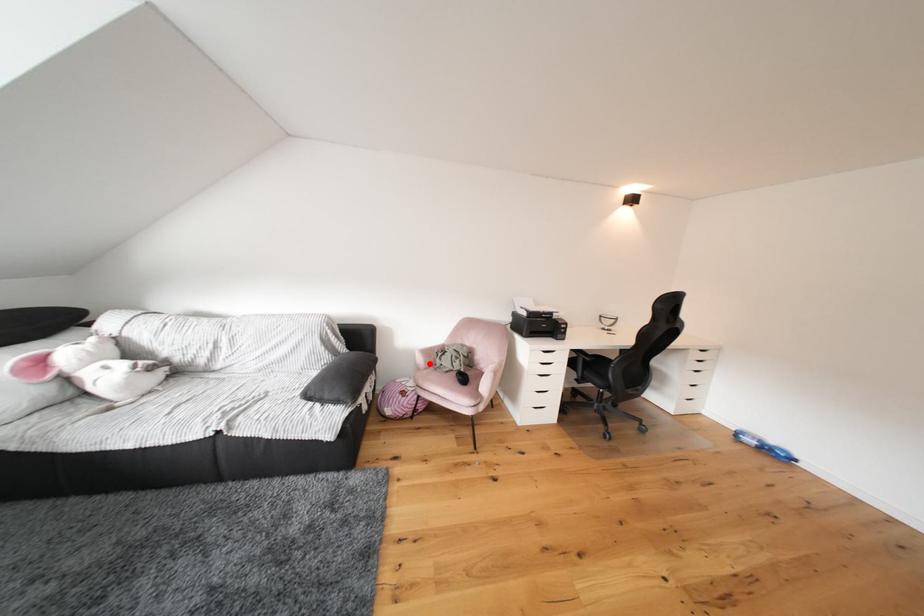
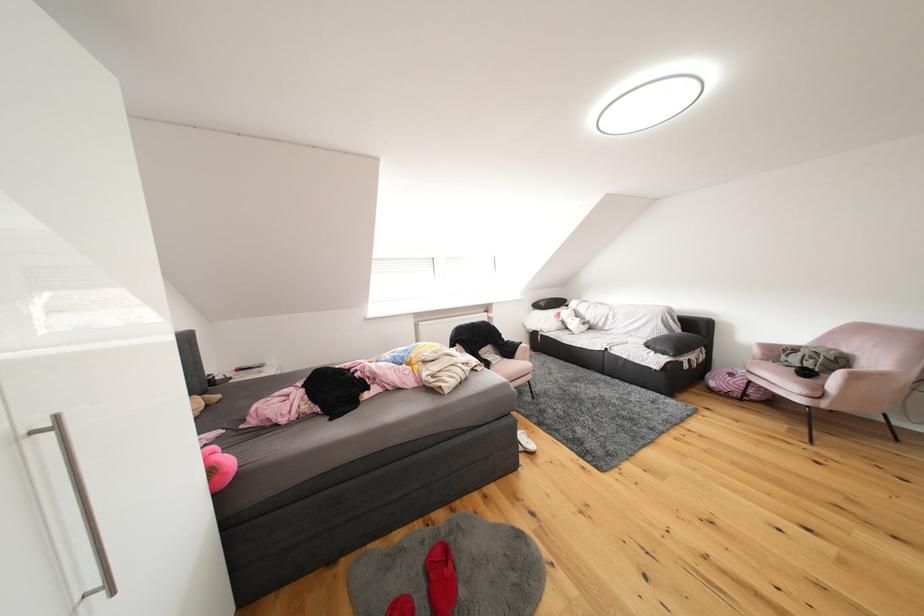
Locate, in the second image, the point that corresponds to the highlighted location in the first image.

(766, 355)